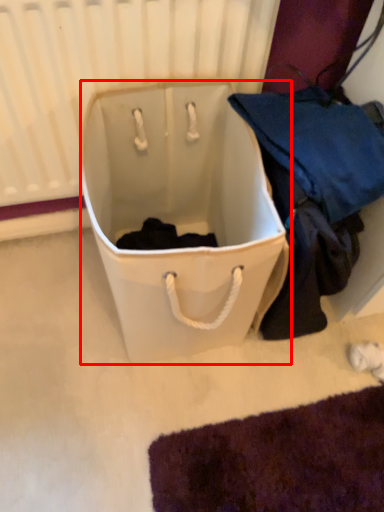
Question: From the image's perspective, where is luggage and bags (annotated by the red box) located in relation to radiator in the image?

Choices:
 (A) above
 (B) below

Answer: (B)